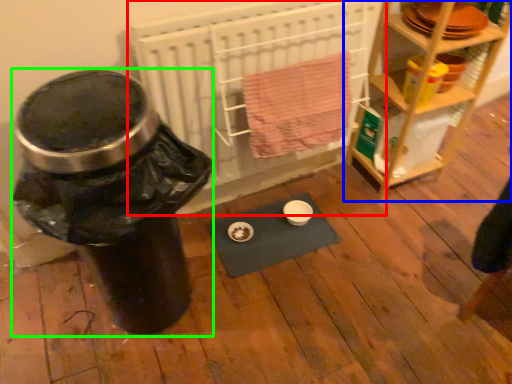
Question: Which object is the closest to the wide (highlighted by a red box)? Choose among these: furniture (highlighted by a blue box) or water cooler (highlighted by a green box).

Choices:
 (A) furniture
 (B) water cooler

Answer: (A)